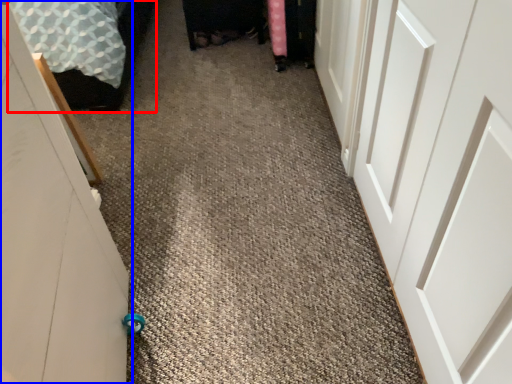
Question: Which object is further to the camera taking this photo, bed (highlighted by a red box) or door (highlighted by a blue box)?

Choices:
 (A) bed
 (B) door

Answer: (A)